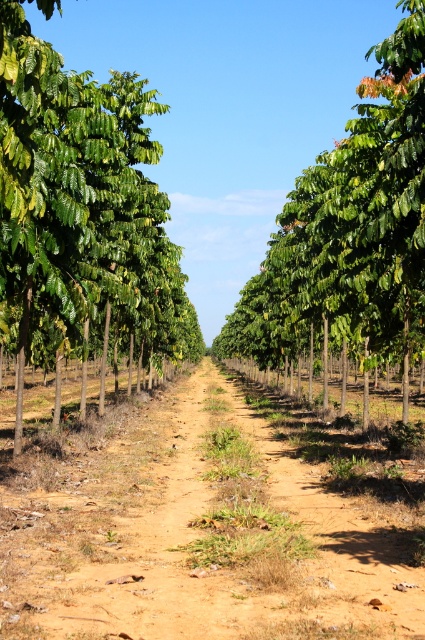
Is brown sandy soil at center above green leafy tree at center?

Actually, brown sandy soil at center is below green leafy tree at center.

At what (x,y) coordinates should I click in order to perform the action: click on brown sandy soil at center. Please return your answer as a coordinate pair (x, y). This screenshot has width=425, height=640. Looking at the image, I should click on (x=200, y=529).

Does green leafy tree at left lie in front of green leafy tree at center?

Yes.

Does green leafy tree at left appear under green leafy tree at center?

Yes.

Locate an element on the screen. green leafy tree at left is located at coordinates (81, 214).

Describe the element at coordinates (200, 529) in the screenshot. I see `brown sandy soil at center` at that location.

Can you confirm if brown sandy soil at center is smaller than green leafy tree at left?

Indeed, brown sandy soil at center has a smaller size compared to green leafy tree at left.

The width and height of the screenshot is (425, 640). I want to click on brown sandy soil at center, so click(200, 529).